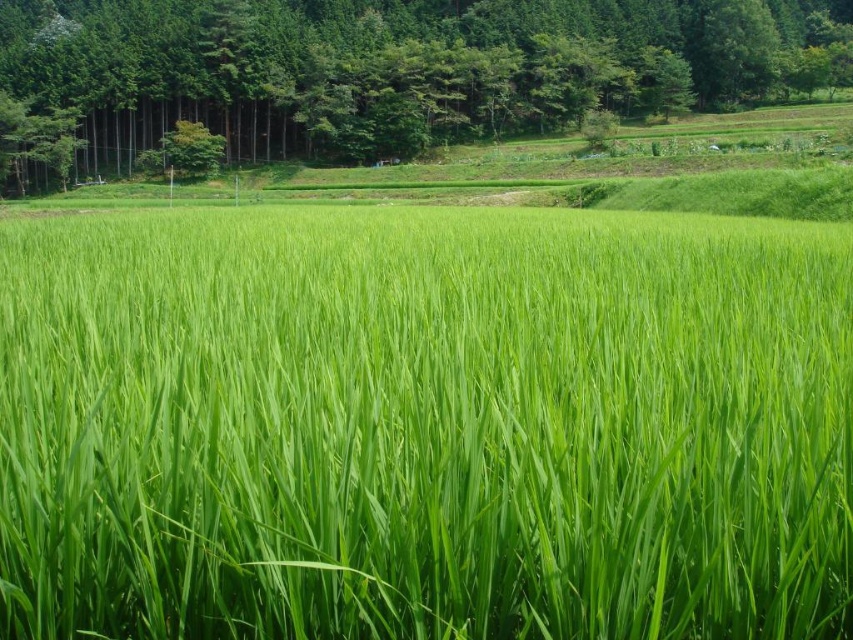
Does green grassy field at center have a lesser width compared to green leafy tree at upper center?

Indeed, green grassy field at center has a lesser width compared to green leafy tree at upper center.

Is green grassy field at center taller than green leafy tree at upper center?

No, green grassy field at center is not taller than green leafy tree at upper center.

Find the location of a particular element. green grassy field at center is located at coordinates (424, 426).